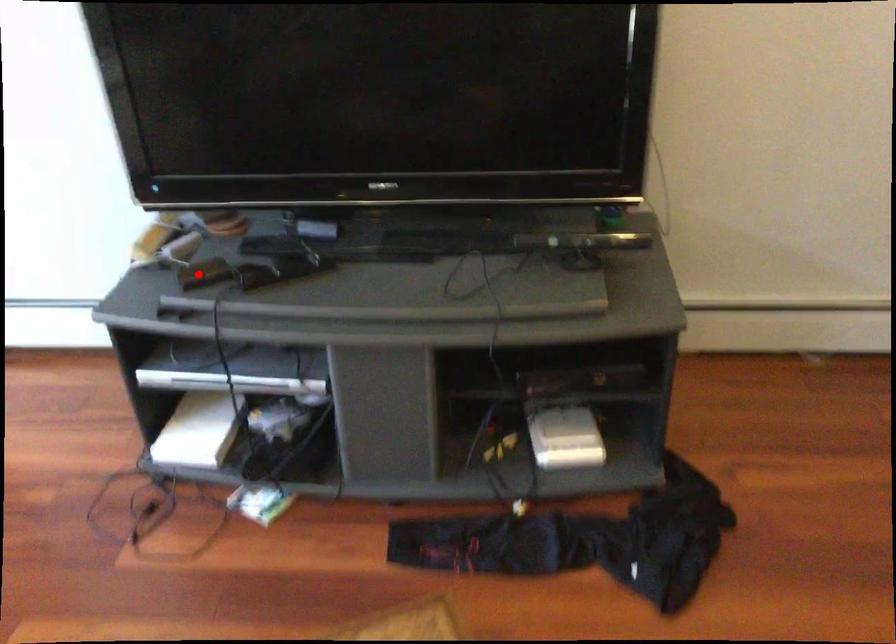
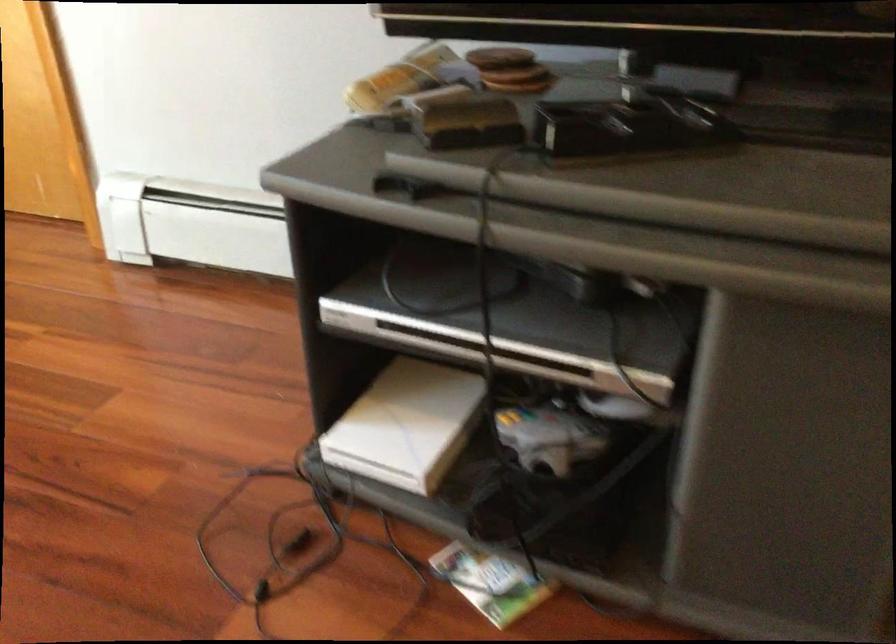
Find the pixel in the second image that matches the highlighted location in the first image.

(469, 124)